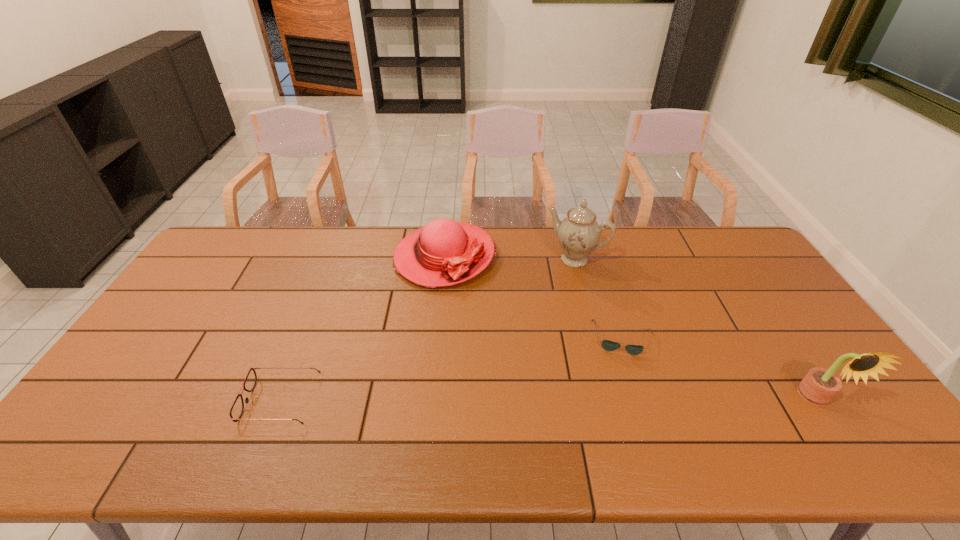
Where is `object identified as the closest to the chinaware`? object identified as the closest to the chinaware is located at coordinates (444, 252).

At what (x,y) coordinates should I click in order to perform the action: click on object that is the third closest to the chinaware. Please return your answer as a coordinate pair (x, y). Looking at the image, I should click on (819, 386).

Image resolution: width=960 pixels, height=540 pixels. I want to click on free space in the image that satisfies the following two spatial constraints: 1. on the front side of the hat; 2. on the left side of the farther sunglasses, so click(x=438, y=338).